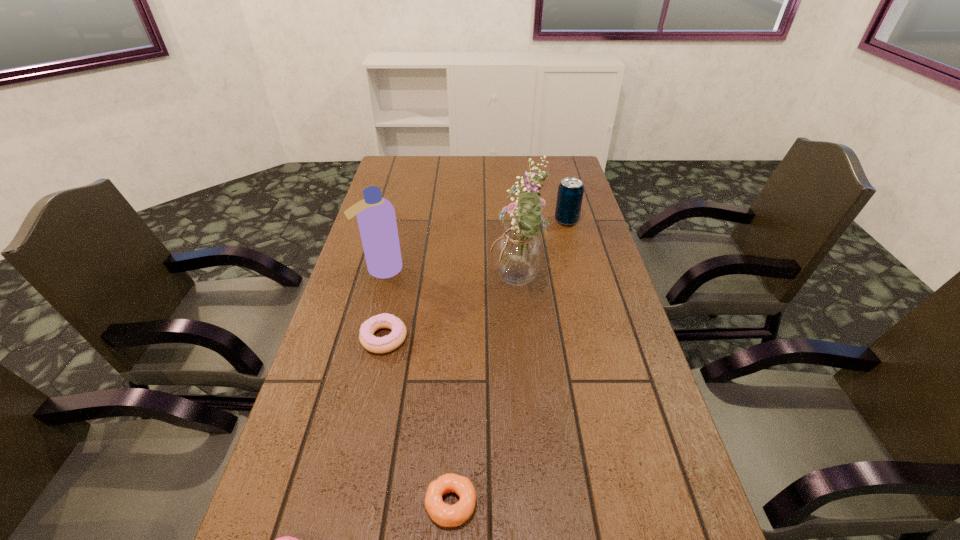
In the image, there is a desktop. At what (x,y) coordinates should I click in order to perform the action: click on free space at the right edge. Please return your answer as a coordinate pair (x, y). The width and height of the screenshot is (960, 540). Looking at the image, I should click on (641, 466).

Find the location of a particular element. blank space at the far left corner of the desktop is located at coordinates (393, 174).

The width and height of the screenshot is (960, 540). What are the coordinates of `free point between the fifth shortest object and the tallest object` in the screenshot? It's located at (449, 277).

Identify the location of vacant area between the fifth farthest object and the farthest doughnut. This screenshot has height=540, width=960. (418, 421).

At what (x,y) coordinates should I click in order to perform the action: click on free spot between the soda can and the rightmost doughnut. Please return your answer as a coordinate pair (x, y). The height and width of the screenshot is (540, 960). Looking at the image, I should click on (509, 362).

In order to click on unoccupied position between the second tallest object and the second farthest doughnut in this screenshot , I will do `click(416, 386)`.

Locate an element on the screen. free space between the farthest doughnut and the second farthest doughnut is located at coordinates (418, 421).

Find the location of a particular element. free space between the bouquet and the third object from right to left is located at coordinates (484, 394).

Find the location of a particular element. object that can be found as the closest to the rightmost object is located at coordinates (518, 252).

Find the location of a particular element. object that can be found as the third closest to the tallest object is located at coordinates (376, 218).